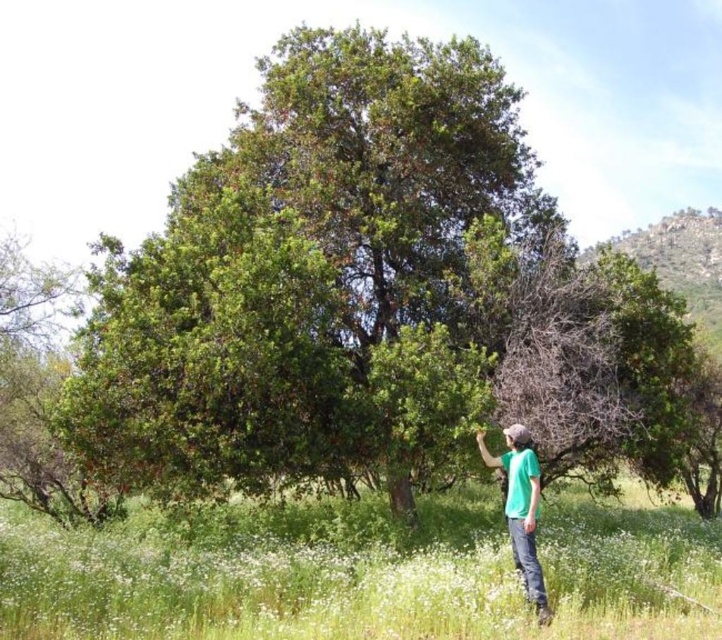
Is green soft grass at lower center bigger than green matte shirt at lower right?

Correct, green soft grass at lower center is larger in size than green matte shirt at lower right.

This screenshot has height=640, width=722. Identify the location of green soft grass at lower center. click(361, 572).